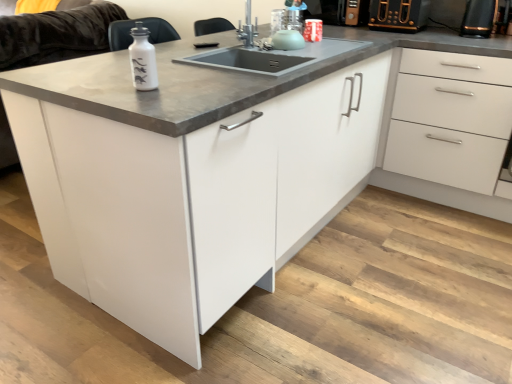
Question: Can you confirm if white glossy bottle at upper left is positioned to the right of white glossy drawer at right?

Choices:
 (A) no
 (B) yes

Answer: (A)

Question: Does white glossy bottle at upper left lie in front of white glossy drawer at right?

Choices:
 (A) yes
 (B) no

Answer: (A)

Question: Is white glossy bottle at upper left positioned far away from white glossy drawer at right?

Choices:
 (A) yes
 (B) no

Answer: (A)

Question: Could you tell me if white glossy bottle at upper left is facing white glossy drawer at right?

Choices:
 (A) no
 (B) yes

Answer: (A)

Question: Does white glossy bottle at upper left have a greater width compared to white glossy drawer at right?

Choices:
 (A) no
 (B) yes

Answer: (A)

Question: Is black plastic toaster at upper right, which is counted as the 2th appliance, starting from the left, inside or outside of white glossy drawer at right?

Choices:
 (A) inside
 (B) outside

Answer: (B)

Question: From the image's perspective, relative to white glossy drawer at right, is black plastic toaster at upper right, which is counted as the 2th appliance, starting from the left, above or below?

Choices:
 (A) below
 (B) above

Answer: (B)

Question: Based on their sizes in the image, would you say black plastic toaster at upper right, which is counted as the 2th appliance, starting from the left, is bigger or smaller than white glossy drawer at right?

Choices:
 (A) big
 (B) small

Answer: (B)

Question: Is point (477, 31) positioned closer to the camera than point (421, 170)?

Choices:
 (A) farther
 (B) closer

Answer: (B)

Question: From a real-world perspective, is black plastic toaster at upper right, placed as the 1th appliance when sorted from left to right, physically located above or below white glossy drawer at right?

Choices:
 (A) below
 (B) above

Answer: (B)

Question: Is black plastic toaster at upper right, which appears as the 2th appliance when viewed from the right, spatially inside white glossy drawer at right, or outside of it?

Choices:
 (A) outside
 (B) inside

Answer: (A)

Question: From the image's perspective, relative to white glossy drawer at right, is black plastic toaster at upper right, placed as the 1th appliance when sorted from left to right, above or below?

Choices:
 (A) below
 (B) above

Answer: (B)

Question: Based on their positions, is black plastic toaster at upper right, placed as the 1th appliance when sorted from left to right, located to the left or right of white glossy drawer at right?

Choices:
 (A) right
 (B) left

Answer: (B)

Question: Is black plastic toaster at upper right, which is counted as the 2th appliance, starting from the left, inside the boundaries of white glossy cabinet at center, or outside?

Choices:
 (A) outside
 (B) inside

Answer: (A)

Question: In terms of size, does black plastic toaster at upper right, the 1th appliance when ordered from right to left, appear bigger or smaller than white glossy cabinet at center?

Choices:
 (A) big
 (B) small

Answer: (B)